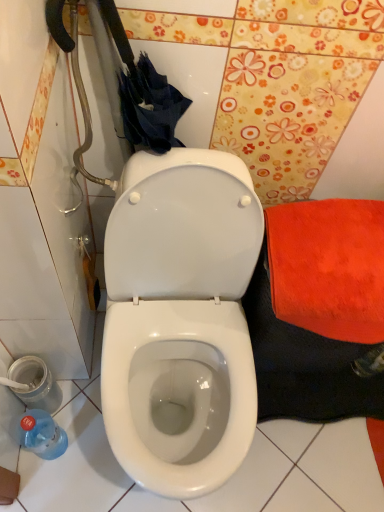
Measure the distance between point (36, 418) and camera.

Point (36, 418) is 38.94 inches from camera.

This screenshot has width=384, height=512. What do you see at coordinates (42, 434) in the screenshot? I see `blue plastic bottle at lower left` at bounding box center [42, 434].

Where is `blue plastic bottle at lower left`? Image resolution: width=384 pixels, height=512 pixels. blue plastic bottle at lower left is located at coordinates (42, 434).

Describe the element at coordinates (33, 383) in the screenshot. I see `metallic silver potty at lower left` at that location.

Measure the distance between metallic silver potty at lower left and camera.

metallic silver potty at lower left and camera are 3.35 feet apart.

Where is `metallic silver potty at lower left`? The width and height of the screenshot is (384, 512). metallic silver potty at lower left is located at coordinates [x=33, y=383].

Looking at this image, in order to face metallic silver potty at lower left, should I rotate leftwards or rightwards?

To align with it, rotate left about 20.368°.

What are the coordinates of `blue plastic bottle at lower left` in the screenshot? It's located at (42, 434).

Between blue plastic bottle at lower left and metallic silver potty at lower left, which one appears on the right side from the viewer's perspective?

blue plastic bottle at lower left.

Between blue plastic bottle at lower left and metallic silver potty at lower left, which one is positioned in front?

blue plastic bottle at lower left.

Considering the positions of point (34, 422) and point (25, 395), is point (34, 422) closer or farther from the camera than point (25, 395)?

Point (34, 422) appears to be closer to the viewer than point (25, 395).

From the image's perspective, between blue plastic bottle at lower left and metallic silver potty at lower left, who is located below?

blue plastic bottle at lower left is shown below in the image.

In the scene shown: From a real-world perspective, which is physically below, blue plastic bottle at lower left or metallic silver potty at lower left?

blue plastic bottle at lower left.

Considering the relative sizes of blue plastic bottle at lower left and metallic silver potty at lower left in the image provided, is blue plastic bottle at lower left wider than metallic silver potty at lower left?

No.

From their relative heights in the image, would you say blue plastic bottle at lower left is taller or shorter than metallic silver potty at lower left?

Clearly, blue plastic bottle at lower left is taller compared to metallic silver potty at lower left.

Based on their sizes in the image, would you say blue plastic bottle at lower left is bigger or smaller than metallic silver potty at lower left?

Considering their sizes, blue plastic bottle at lower left takes up more space than metallic silver potty at lower left.

Choose the correct answer: Is blue plastic bottle at lower left inside metallic silver potty at lower left or outside it?

The correct answer is: outside.

Is blue plastic bottle at lower left far away from metallic silver potty at lower left?

blue plastic bottle at lower left is near metallic silver potty at lower left, not far away.

Is blue plastic bottle at lower left looking in the opposite direction of metallic silver potty at lower left?

No.

Measure the distance between blue plastic bottle at lower left and metallic silver potty at lower left.

The distance of blue plastic bottle at lower left from metallic silver potty at lower left is 4.08 inches.

Identify the location of bottle on the right side of metallic silver potty at lower left. The width and height of the screenshot is (384, 512). (42, 434).

Which object is positioned more to the right, metallic silver potty at lower left or blue plastic bottle at lower left?

blue plastic bottle at lower left is more to the right.

Who is more distant, metallic silver potty at lower left or blue plastic bottle at lower left?

metallic silver potty at lower left is further from the camera.

Which is farther, (47, 409) or (61, 450)?

Positioned behind is point (61, 450).

In the scene shown: From the image's perspective, is metallic silver potty at lower left located above or below blue plastic bottle at lower left?

From the image's perspective, metallic silver potty at lower left appears above blue plastic bottle at lower left.

From a real-world perspective, who is located lower, metallic silver potty at lower left or blue plastic bottle at lower left?

From a 3D spatial view, blue plastic bottle at lower left is below.

Considering the relative sizes of metallic silver potty at lower left and blue plastic bottle at lower left in the image provided, is metallic silver potty at lower left thinner than blue plastic bottle at lower left?

Incorrect, the width of metallic silver potty at lower left is not less than that of blue plastic bottle at lower left.

From their relative heights in the image, would you say metallic silver potty at lower left is taller or shorter than blue plastic bottle at lower left?

Clearly, metallic silver potty at lower left is shorter compared to blue plastic bottle at lower left.

Who is bigger, metallic silver potty at lower left or blue plastic bottle at lower left?

blue plastic bottle at lower left is bigger.

Is metallic silver potty at lower left situated inside blue plastic bottle at lower left or outside?

metallic silver potty at lower left is spatially situated outside blue plastic bottle at lower left.

Are metallic silver potty at lower left and blue plastic bottle at lower left beside each other?

There is a gap between metallic silver potty at lower left and blue plastic bottle at lower left.

Could you tell me if metallic silver potty at lower left is facing blue plastic bottle at lower left?

No, metallic silver potty at lower left is not turned towards blue plastic bottle at lower left.

The width and height of the screenshot is (384, 512). Find the location of `potty on the left of the blue plastic bottle at lower left`. potty on the left of the blue plastic bottle at lower left is located at coordinates (33, 383).

Identify the location of bottle below the metallic silver potty at lower left (from the image's perspective). Image resolution: width=384 pixels, height=512 pixels. (42, 434).

In the image, there is a metallic silver potty at lower left. In order to click on bottle below it (from a real-world perspective) in this screenshot , I will do `click(42, 434)`.